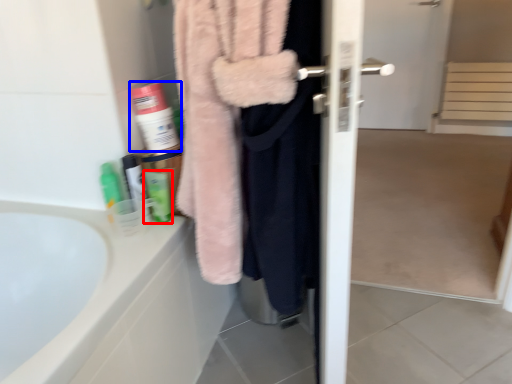
Question: Which of the following is the closest to the observer, toiletry (highlighted by a red box) or cleaning product (highlighted by a blue box)?

Choices:
 (A) toiletry
 (B) cleaning product

Answer: (A)